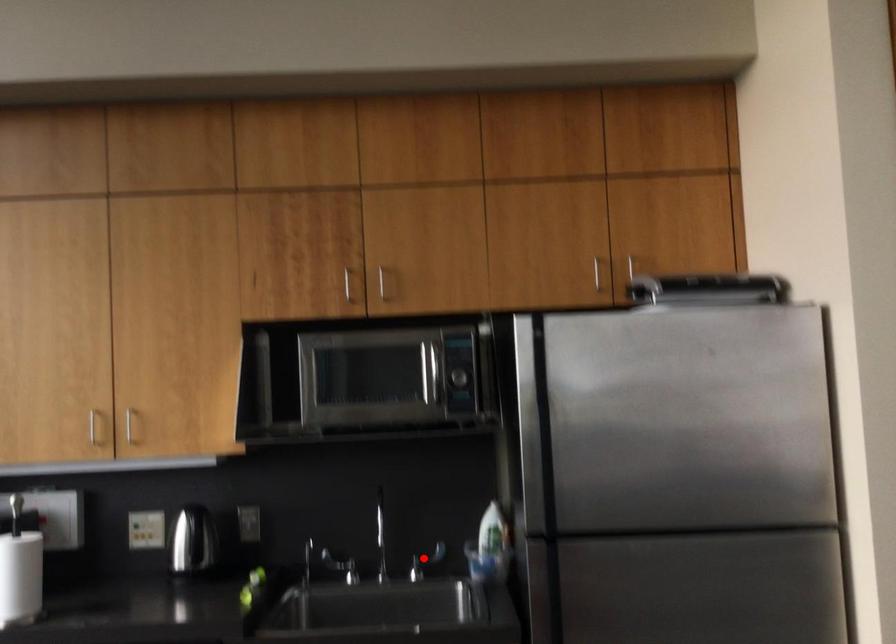
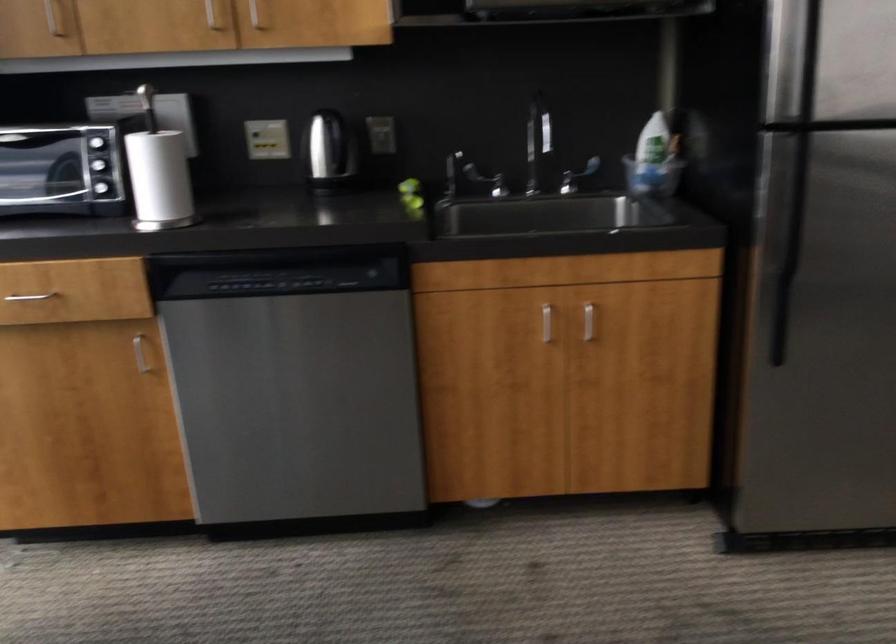
In the second image, find the point that corresponds to the highlighted location in the first image.

(576, 176)